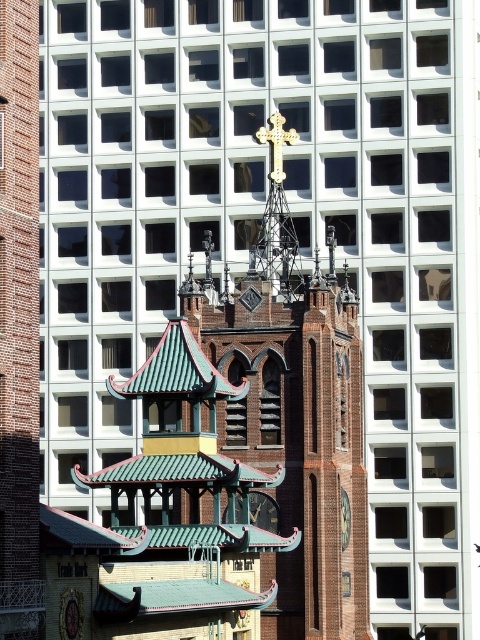
Based on the photo, you are an urban planner assessing the skyline of this city. You need to determine which object, the gold metallic cross at upper center or the gold metallic clock at center, would cast a longer shadow during midday. Based on their positions in the image, which one do you think it is?

The gold metallic cross at upper center is much taller than the gold metallic clock at center, so it would cast a longer shadow during midday.

You are an architect analyzing the building layout. Which gold metallic cross is closer to the viewer, the gold metallic cross at center or the gold metallic cross at upper center?

The gold metallic cross at center is closer to the viewer because it is positioned in front of the gold metallic cross at upper center.